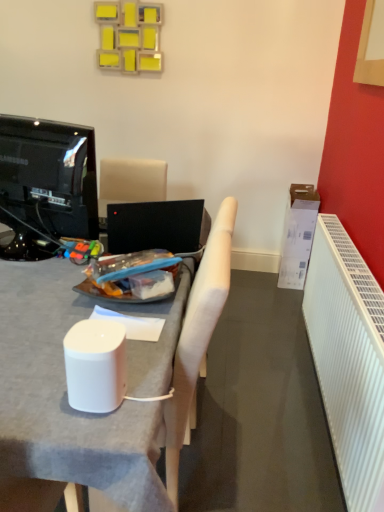
Question: From a real-world perspective, is white cardboard box at right located beneath white fabric chair at center?

Choices:
 (A) no
 (B) yes

Answer: (B)

Question: Is white cardboard box at right wider than white fabric chair at center?

Choices:
 (A) no
 (B) yes

Answer: (A)

Question: Is white cardboard box at right touching white fabric chair at center?

Choices:
 (A) no
 (B) yes

Answer: (A)

Question: Considering the relative sizes of white cardboard box at right and white fabric chair at center in the image provided, is white cardboard box at right bigger than white fabric chair at center?

Choices:
 (A) yes
 (B) no

Answer: (B)

Question: Is white cardboard box at right in front of white fabric chair at center?

Choices:
 (A) no
 (B) yes

Answer: (A)

Question: In terms of height, does black glossy television at left look taller or shorter compared to white fabric chair at center?

Choices:
 (A) short
 (B) tall

Answer: (A)

Question: Considering their positions, is black glossy television at left located in front of or behind white fabric chair at center?

Choices:
 (A) behind
 (B) front

Answer: (B)

Question: In terms of width, does black glossy television at left look wider or thinner when compared to white fabric chair at center?

Choices:
 (A) wide
 (B) thin

Answer: (B)

Question: From a real-world perspective, is black glossy television at left physically located above or below white fabric chair at center?

Choices:
 (A) below
 (B) above

Answer: (B)

Question: Does point (329, 361) appear closer or farther from the camera than point (289, 227)?

Choices:
 (A) farther
 (B) closer

Answer: (B)

Question: Looking at their shapes, would you say white ribbed radiator at right is wider or thinner than white cardboard box at right?

Choices:
 (A) wide
 (B) thin

Answer: (B)

Question: From the image's perspective, relative to white cardboard box at right, is white ribbed radiator at right above or below?

Choices:
 (A) below
 (B) above

Answer: (A)

Question: Which is correct: white ribbed radiator at right is inside white cardboard box at right, or outside of it?

Choices:
 (A) outside
 (B) inside

Answer: (A)

Question: From the image's perspective, is white fabric chair at center located above or below white ribbed radiator at right?

Choices:
 (A) below
 (B) above

Answer: (B)

Question: Is white fabric chair at center bigger or smaller than white ribbed radiator at right?

Choices:
 (A) big
 (B) small

Answer: (A)